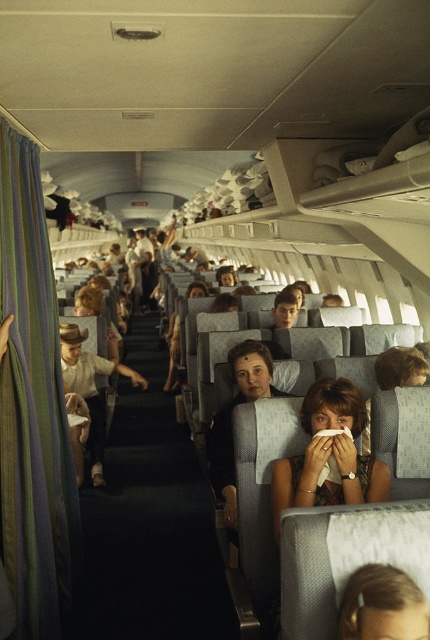
You are seated in the airplane cabin and want to locate the black fabric at center. According to the coordinates provided, where would you find it?

The black fabric at center is located at coordinates point (150, 522).

You are a flight attendant checking the cabin. You notice a black fabric at center and a matte black hair at center. Which object is wider?

The black fabric at center is wider than the matte black hair at center.